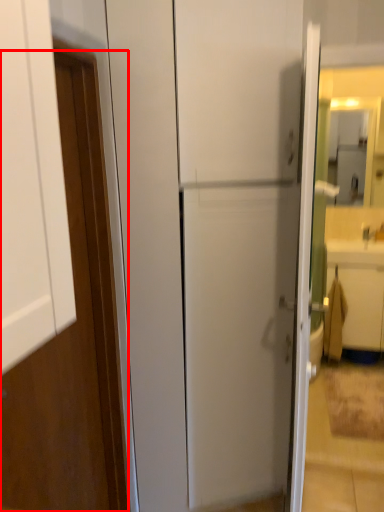
Question: From the image's perspective, what is the correct spatial positioning of door (annotated by the red box) in reference to drawer?

Choices:
 (A) above
 (B) below

Answer: (A)